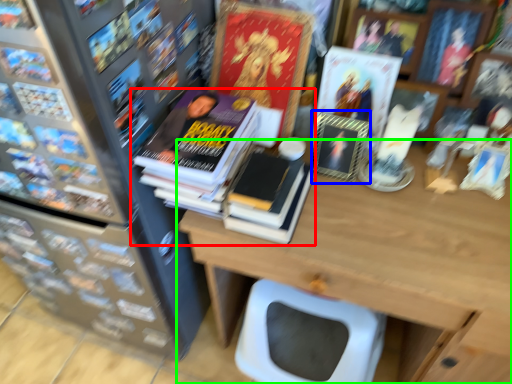
Question: Which object is positioned closest to book (highlighted by a red box)? Select from book cover (highlighted by a blue box) and table (highlighted by a green box).

Choices:
 (A) book cover
 (B) table

Answer: (A)